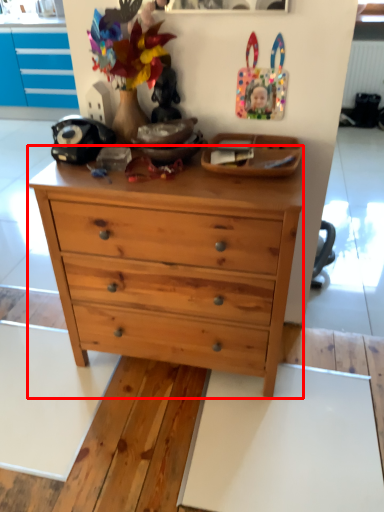
Question: In this image, where is chest of drawers (annotated by the red box) located relative to plate?

Choices:
 (A) right
 (B) left

Answer: (B)